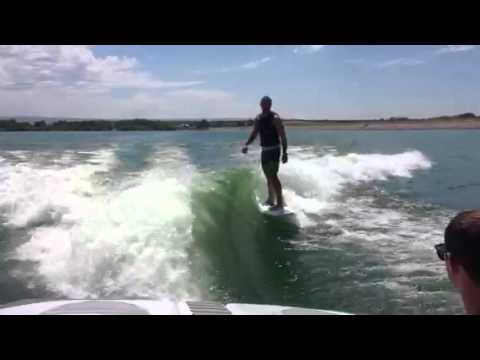
The image size is (480, 360). Find the location of `board`. board is located at coordinates (284, 210).